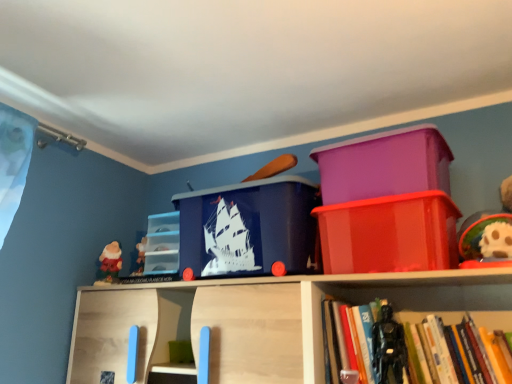
Question: Is red velvet santa at left, arranged as the 2th toy when viewed from the right, at the left side of hardcover book at lower right?

Choices:
 (A) no
 (B) yes

Answer: (B)

Question: Is red velvet santa at left, arranged as the 2th toy when viewed from the right, smaller than hardcover book at lower right?

Choices:
 (A) no
 (B) yes

Answer: (B)

Question: Considering the relative sizes of red velvet santa at left, arranged as the 2th toy when viewed from the right, and hardcover book at lower right in the image provided, is red velvet santa at left, arranged as the 2th toy when viewed from the right, shorter than hardcover book at lower right?

Choices:
 (A) no
 (B) yes

Answer: (B)

Question: Is red velvet santa at left, arranged as the 2th toy when viewed from the right, at the right side of hardcover book at lower right?

Choices:
 (A) yes
 (B) no

Answer: (B)

Question: Is the depth of red velvet santa at left, the 1th toy viewed from the back, greater than that of hardcover book at lower right?

Choices:
 (A) yes
 (B) no

Answer: (A)

Question: Considering the positions of red velvet santa at left, arranged as the 2th toy when viewed from the right, and blue plastic storage box at center, which is the third storage box from right to left, in the image, is red velvet santa at left, arranged as the 2th toy when viewed from the right, taller or shorter than blue plastic storage box at center, which is the third storage box from right to left,?

Choices:
 (A) tall
 (B) short

Answer: (B)

Question: From the image's perspective, is red velvet santa at left, arranged as the 2th toy when viewed from the right, above or below blue plastic storage box at center, which is the third storage box from right to left?

Choices:
 (A) below
 (B) above

Answer: (A)

Question: Relative to blue plastic storage box at center, arranged as the 2th storage box when viewed from the left, is red velvet santa at left, the 1th toy viewed from the back, in front or behind?

Choices:
 (A) behind
 (B) front

Answer: (A)

Question: Looking at their shapes, would you say red velvet santa at left, the 1th toy viewed from the back, is wider or thinner than blue plastic storage box at center, which is the third storage box from right to left?

Choices:
 (A) wide
 (B) thin

Answer: (B)

Question: Based on their sizes in the image, would you say hardcover book at lower right is bigger or smaller than glossy plastic container at upper right, which is counted as the 1th storage box, starting from the right?

Choices:
 (A) big
 (B) small

Answer: (B)

Question: Is hardcover book at lower right in front of or behind glossy plastic container at upper right, the fourth storage box in the left-to-right sequence, in the image?

Choices:
 (A) front
 (B) behind

Answer: (A)

Question: Is hardcover book at lower right situated inside glossy plastic container at upper right, which is counted as the 1th storage box, starting from the right, or outside?

Choices:
 (A) inside
 (B) outside

Answer: (B)

Question: Is point (332, 374) closer or farther from the camera than point (336, 268)?

Choices:
 (A) farther
 (B) closer

Answer: (B)

Question: From a real-world perspective, is hardcover book at lower right positioned above or below red velvet santa at left, the first toy viewed from the left?

Choices:
 (A) above
 (B) below

Answer: (B)

Question: Based on their sizes in the image, would you say hardcover book at lower right is bigger or smaller than red velvet santa at left, the first toy viewed from the left?

Choices:
 (A) small
 (B) big

Answer: (B)